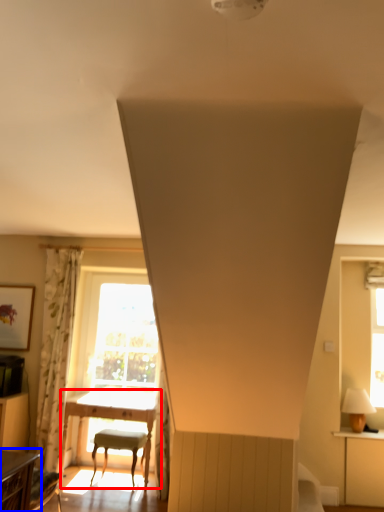
Question: Among these objects, which one is farthest to the camera, table (highlighted by a red box) or table (highlighted by a blue box)?

Choices:
 (A) table
 (B) table

Answer: (A)